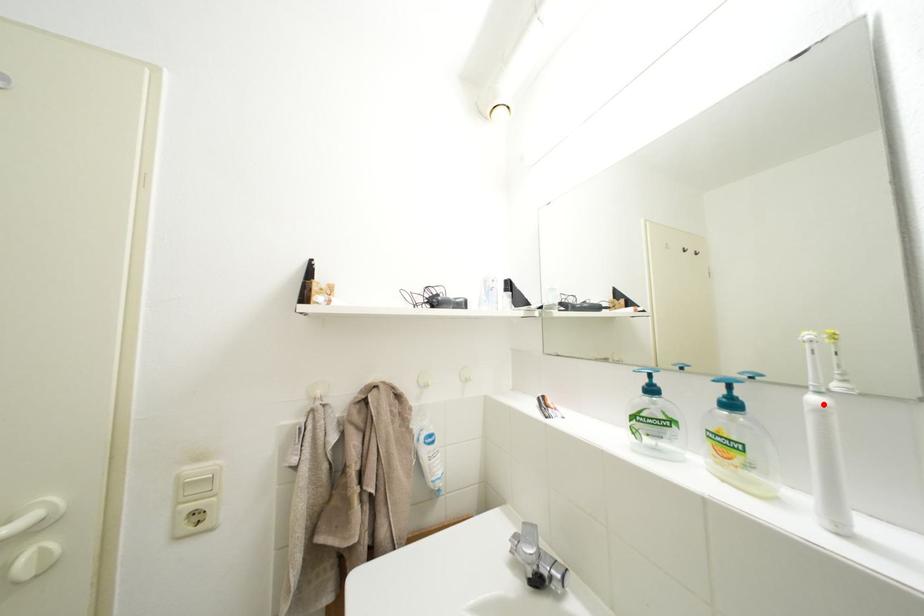
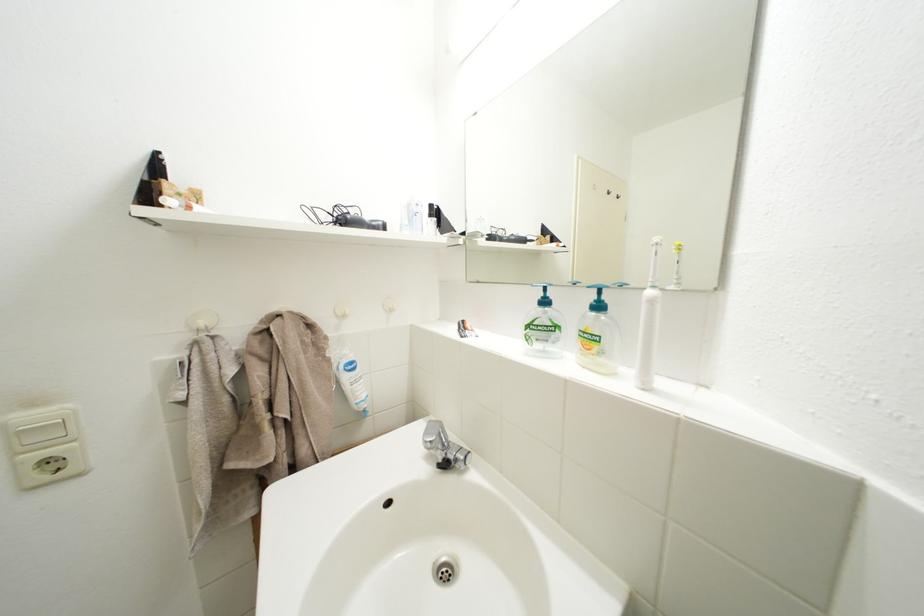
Where in the second image is the point corresponding to the highlighted location from the first image?

(659, 298)